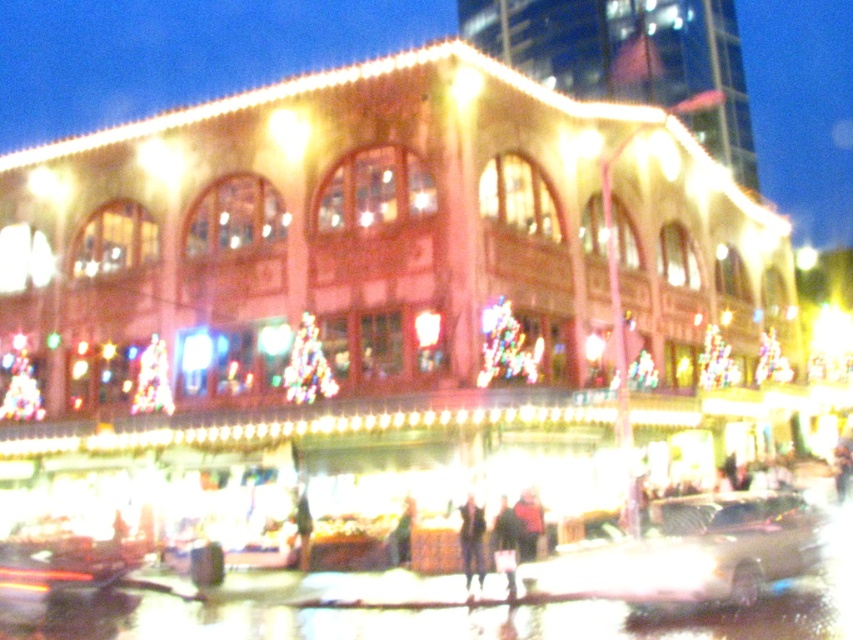
Question: Is clear glass water at lower center bigger than dark brown leather jacket at center?

Choices:
 (A) no
 (B) yes

Answer: (B)

Question: Is clear glass water at lower center below metallic gold car at lower center?

Choices:
 (A) no
 (B) yes

Answer: (B)

Question: Which point appears farthest from the camera in this image?

Choices:
 (A) (473, 515)
 (B) (502, 545)
 (C) (105, 586)

Answer: (C)

Question: Is metallic gold car at lower center thinner than dark brown leather jacket at center?

Choices:
 (A) yes
 (B) no

Answer: (B)

Question: Which point appears farthest from the camera in this image?

Choices:
 (A) (369, 616)
 (B) (515, 531)
 (C) (805, 554)

Answer: (B)

Question: Estimate the real-world distances between objects in this image. Which object is closer to the dark brown leather jacket at center?

Choices:
 (A) metallic gold car at lower center
 (B) dark blue jacket at center

Answer: (B)